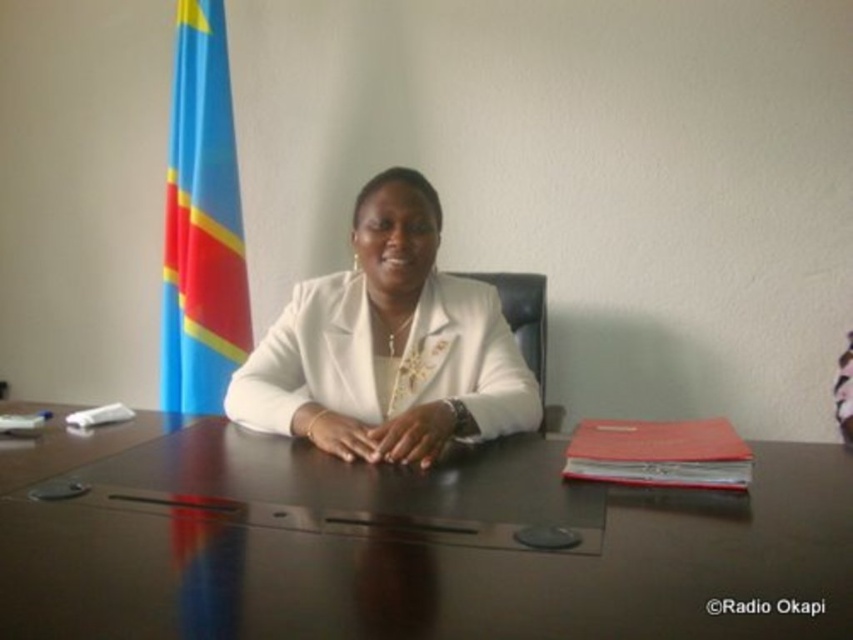
The height and width of the screenshot is (640, 853). What do you see at coordinates (405, 544) in the screenshot?
I see `dark brown polished wood table at center` at bounding box center [405, 544].

Does dark brown polished wood table at center appear on the right side of white glossy jacket at center?

No, dark brown polished wood table at center is not to the right of white glossy jacket at center.

Locate an element on the screen. The width and height of the screenshot is (853, 640). dark brown polished wood table at center is located at coordinates (405, 544).

Where is `dark brown polished wood table at center`? dark brown polished wood table at center is located at coordinates (405, 544).